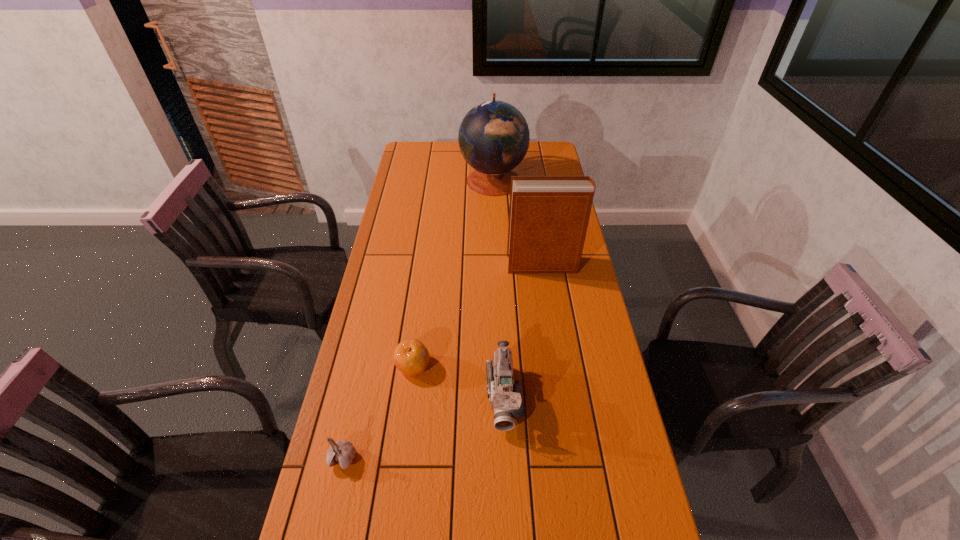
Identify the location of free space at the right edge. The width and height of the screenshot is (960, 540). (623, 536).

In the image, there is a desktop. Where is `vacant space at the far left corner`? The width and height of the screenshot is (960, 540). vacant space at the far left corner is located at coordinates (435, 153).

Image resolution: width=960 pixels, height=540 pixels. In order to click on vacant space that's between the third tallest object and the second object from left to right in this screenshot , I will do `click(459, 381)`.

This screenshot has width=960, height=540. What are the coordinates of `free point between the fourth nearest object and the garlic` in the screenshot? It's located at (443, 362).

Where is `blank region between the hardback book and the nearest object`? This screenshot has height=540, width=960. blank region between the hardback book and the nearest object is located at coordinates (443, 362).

Find the location of a particular element. Image resolution: width=960 pixels, height=540 pixels. unoccupied position between the leftmost object and the camcorder is located at coordinates (423, 427).

I want to click on blank region between the camcorder and the fourth nearest object, so click(523, 330).

The height and width of the screenshot is (540, 960). I want to click on vacant region between the second object from left to right and the nearest object, so click(378, 412).

At what (x,y) coordinates should I click in order to perform the action: click on free area in between the second object from left to right and the garlic. Please return your answer as a coordinate pair (x, y). Image resolution: width=960 pixels, height=540 pixels. Looking at the image, I should click on (378, 412).

Locate an element on the screen. The width and height of the screenshot is (960, 540). free space between the leftmost object and the fourth nearest object is located at coordinates (443, 362).